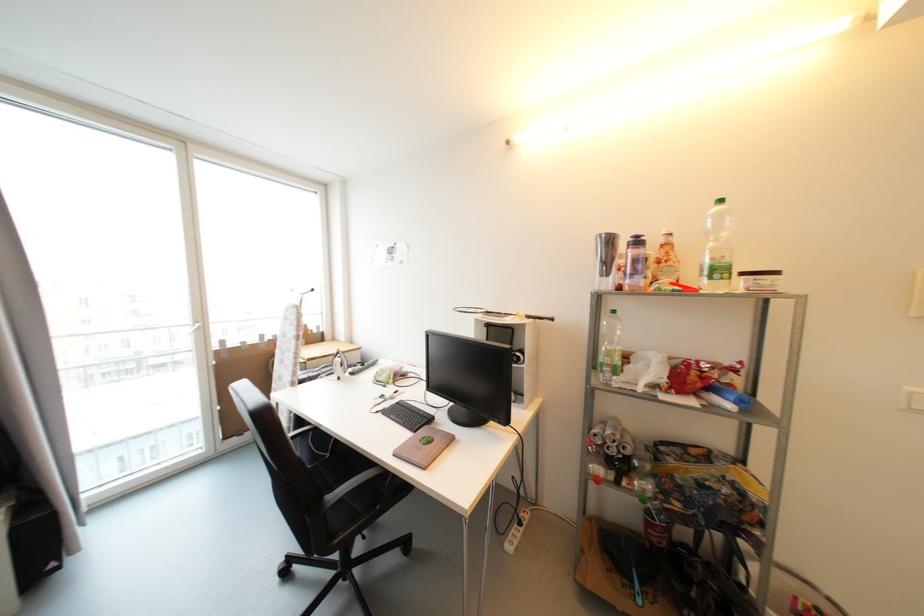
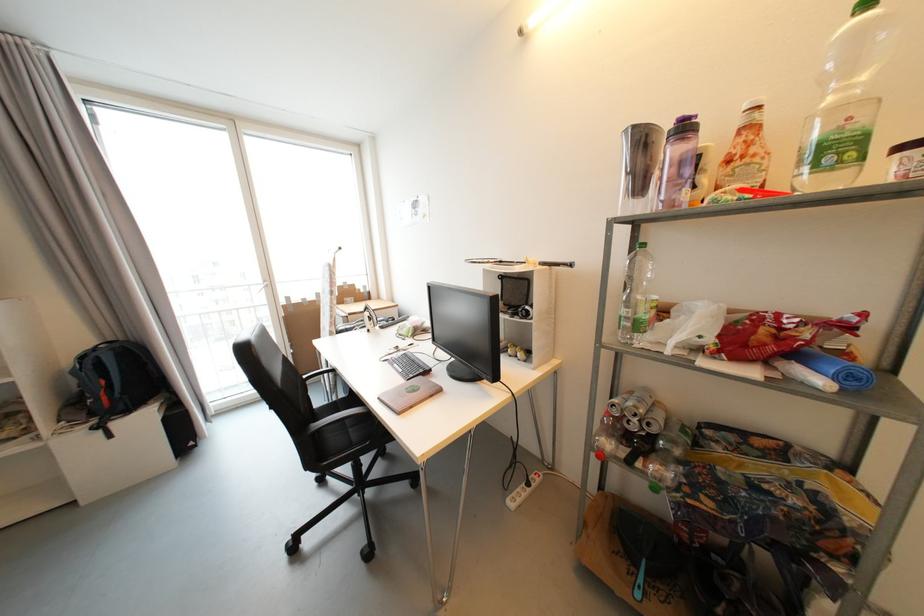
The point at (613, 367) is marked in the first image. Where is the corresponding point in the second image?

(631, 320)